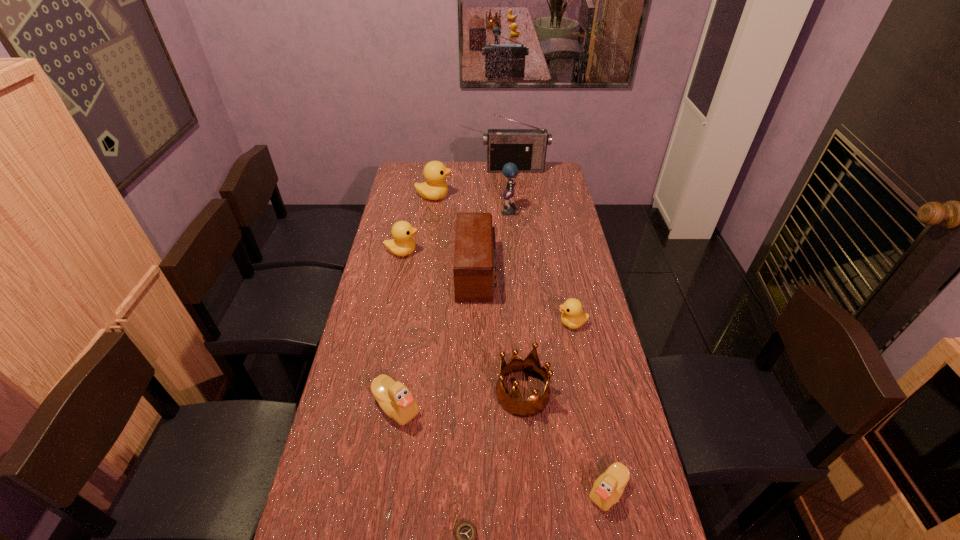
Identify the location of the farther radio receiver. (526, 148).

Where is `the taller radio receiver`? The width and height of the screenshot is (960, 540). the taller radio receiver is located at coordinates (526, 148).

In order to click on rag doll in this screenshot , I will do `click(509, 170)`.

You are a GUI agent. You are given a task and a screenshot of the screen. Output one action in this format:
    pyautogui.click(x=<x>, y=<y>)
    Task: Click on the eighth nearest object
    The image size is (960, 540).
    Given the screenshot: What is the action you would take?
    pyautogui.click(x=509, y=170)

At what (x,y) coordinates should I click in order to perform the action: click on the tallest duck. Please return your answer as a coordinate pair (x, y). The height and width of the screenshot is (540, 960). Looking at the image, I should click on (435, 188).

Where is `the farthest yellow duck`? the farthest yellow duck is located at coordinates (435, 188).

Where is `the nearer radio receiver`? Image resolution: width=960 pixels, height=540 pixels. the nearer radio receiver is located at coordinates (474, 268).

In order to click on crown in this screenshot , I will do `click(513, 403)`.

Locate an element on the screen. This screenshot has height=540, width=960. the second farthest duck is located at coordinates (403, 244).

Locate an element on the screen. the second farthest yellow duck is located at coordinates (403, 244).